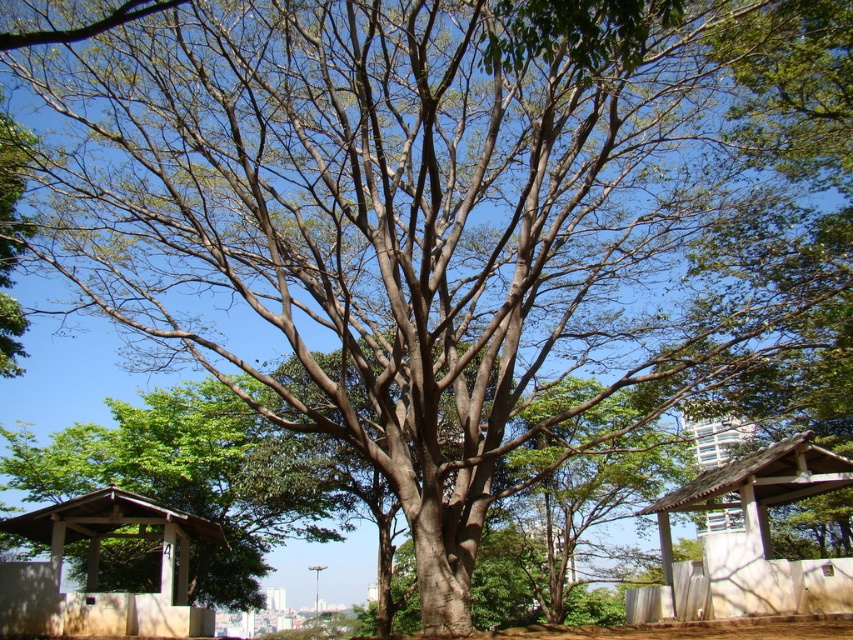
Question: Which of the following is the closest to the observer?

Choices:
 (A) (105, 508)
 (B) (837, 461)

Answer: (B)

Question: Does white wood gazebo at lower right appear on the left side of brown wood gazebo at lower left?

Choices:
 (A) yes
 (B) no

Answer: (B)

Question: Is white wood gazebo at lower right positioned before brown wood gazebo at lower left?

Choices:
 (A) no
 (B) yes

Answer: (B)

Question: Among these points, which one is farthest from the camera?

Choices:
 (A) click(x=148, y=509)
 (B) click(x=705, y=506)

Answer: (B)

Question: Which point appears closest to the camera in this image?

Choices:
 (A) (18, 620)
 (B) (634, 596)

Answer: (A)

Question: Is white wood gazebo at lower right below brown wood gazebo at lower left?

Choices:
 (A) yes
 (B) no

Answer: (A)